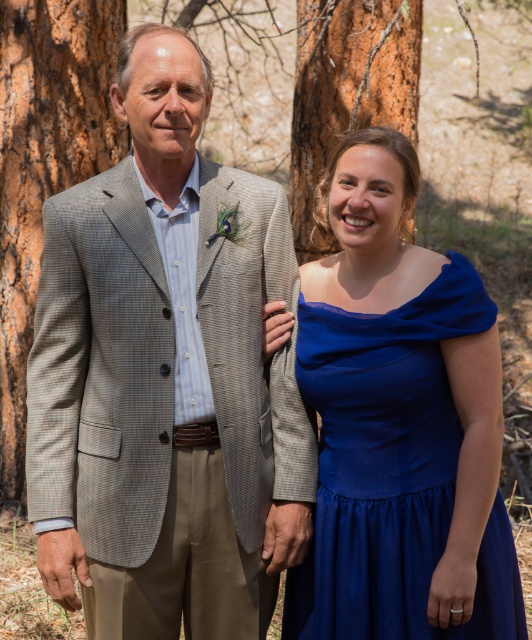
Question: In this image, where is royal blue satin dress at right located relative to brown rough bark at upper center?

Choices:
 (A) left
 (B) right

Answer: (A)

Question: Among these objects, which one is nearest to the camera?

Choices:
 (A) royal blue satin dress at right
 (B) gray checkered suit at left

Answer: (A)

Question: Which object appears farthest from the camera in this image?

Choices:
 (A) gray checkered suit at left
 (B) royal blue satin dress at right
 (C) brown textured bark at left

Answer: (C)

Question: Considering the real-world distances, which object is farthest from the gray checkered suit at left?

Choices:
 (A) brown textured bark at left
 (B) brown rough bark at upper center
 (C) royal blue satin dress at right

Answer: (B)

Question: Is royal blue satin dress at right positioned in front of brown rough bark at upper center?

Choices:
 (A) yes
 (B) no

Answer: (A)

Question: Does gray checkered suit at left have a smaller size compared to brown rough bark at upper center?

Choices:
 (A) yes
 (B) no

Answer: (A)